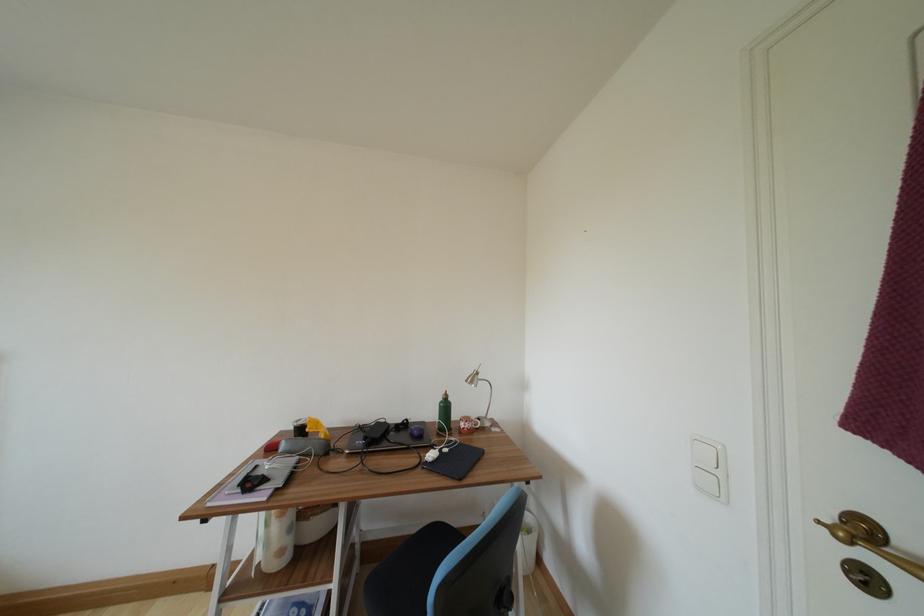
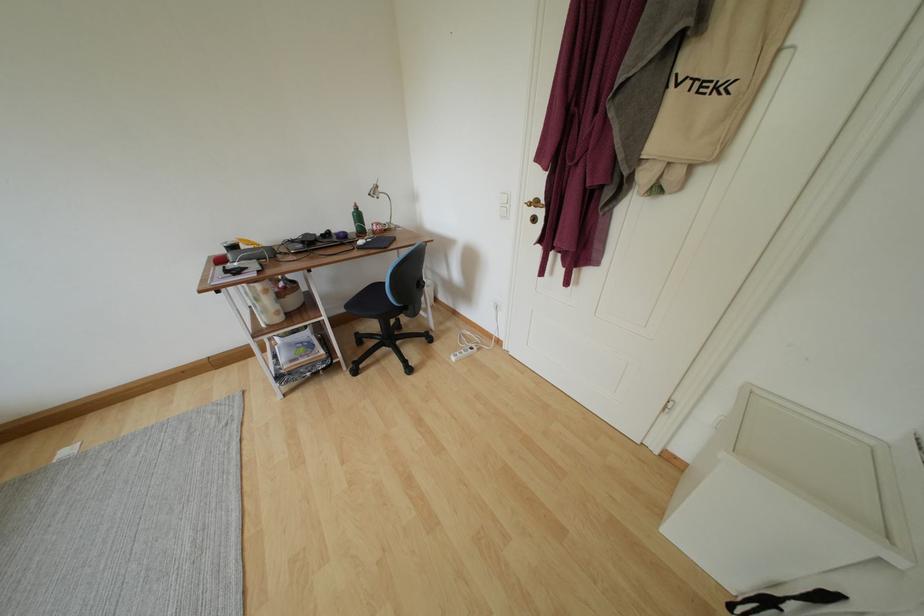
Where in the second image is the point corresponding to pixel 451 411 from the first image?

(363, 220)